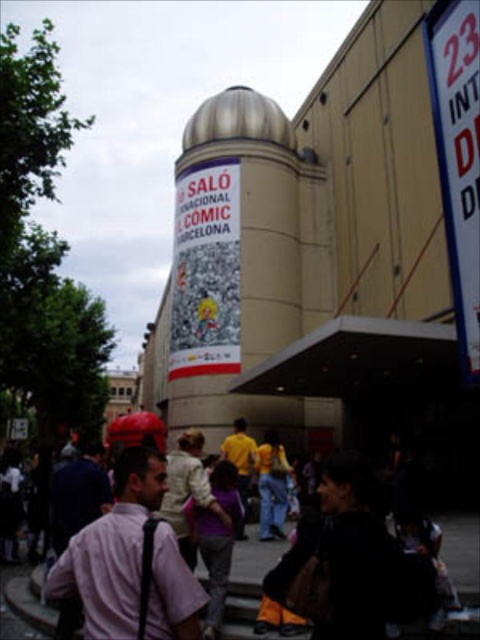
You are a photographer standing at the entrance of the building. You want to capture a photo of the dark clothing crowd at center without any obstructions. Is there enough space to move around the crowd to get a clear shot?

The dark clothing crowd at center is located at point (131,556), but since the crowd is in the center, there might be obstructions from other people in the crowd itself. However, the exact spatial arrangement isn not provided, so it is uncertain if there is enough space to move around for a clear shot without more details on the crowd density and surrounding areas.

You are an attendee at the comic convention in Barcelona. You notice a pink cotton shirt at center and a white plastic sign at upper right. Which object is positioned higher in the image?

The white plastic sign at upper right is positioned higher than the pink cotton shirt at center in the image.

You are a visitor at the comic convention in Barcelona. You see the dark clothing crowd at center and the white plastic sign at upper right. Which object is located to the right of the other?

The dark clothing crowd at center is to the left of white plastic sign at upper right, so the white plastic sign at upper right is located to the right of the dark clothing crowd at center.